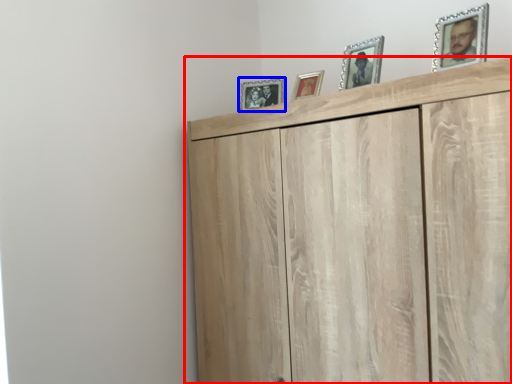
Question: Which object appears closest to the camera in this image, cupboard (highlighted by a red box) or picture frame (highlighted by a blue box)?

Choices:
 (A) cupboard
 (B) picture frame

Answer: (A)